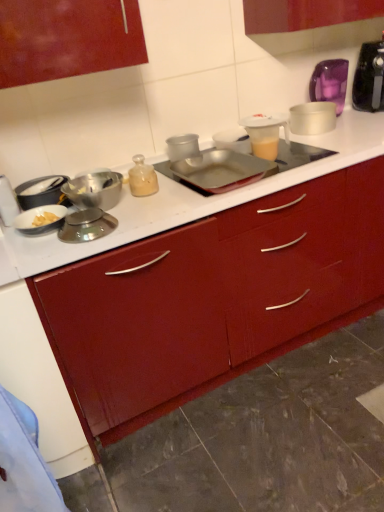
Locate an element on the screen. The width and height of the screenshot is (384, 512). empty space that is to the right of shiny silver bowl at left, marked as the 4th kitchen appliance in a left-to-right arrangement is located at coordinates (160, 207).